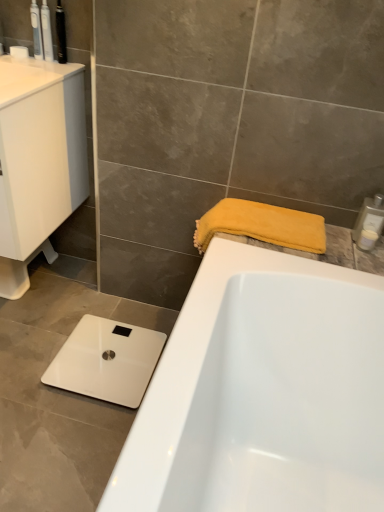
Measure the distance between matte white toothbrush at upper left, the fourth toiletry ordered from the bottom, and camera.

matte white toothbrush at upper left, the fourth toiletry ordered from the bottom, is 1.39 meters from camera.

Describe the element at coordinates (262, 225) in the screenshot. The width and height of the screenshot is (384, 512). I see `yellow soft towel at upper right` at that location.

This screenshot has width=384, height=512. Find the location of `translucent plastic toothbrush at upper left, which is the first toiletry in top-to-bottom order`. translucent plastic toothbrush at upper left, which is the first toiletry in top-to-bottom order is located at coordinates (36, 30).

Where is `white glossy scale at lower left`? white glossy scale at lower left is located at coordinates tap(106, 361).

From a real-world perspective, is yellow soft towel at upper right below translucent plastic toothbrush at upper left, which ranks as the fifth toiletry in right-to-left order?

Indeed, from a real-world perspective, yellow soft towel at upper right is positioned beneath translucent plastic toothbrush at upper left, which ranks as the fifth toiletry in right-to-left order.

Is yellow soft towel at upper right further to the viewer compared to translucent plastic toothbrush at upper left, which ranks as the fifth toiletry in right-to-left order?

No, the depth of yellow soft towel at upper right is less than that of translucent plastic toothbrush at upper left, which ranks as the fifth toiletry in right-to-left order.

Could you tell me if yellow soft towel at upper right is facing translucent plastic toothbrush at upper left, which ranks as the fifth toiletry in right-to-left order?

No, yellow soft towel at upper right is not aimed at translucent plastic toothbrush at upper left, which ranks as the fifth toiletry in right-to-left order.

From the image's perspective, is yellow soft towel at upper right positioned above or below translucent plastic toothbrush at upper left, which ranks as the fifth toiletry in bottom-to-top order?

From the image's perspective, yellow soft towel at upper right appears below translucent plastic toothbrush at upper left, which ranks as the fifth toiletry in bottom-to-top order.

Does point (131, 358) come behind point (43, 31)?

Yes, it is behind point (43, 31).

Is the position of white glossy scale at lower left more distant than that of matte white toothbrush at upper left, the second toiletry from the top?

Yes, white glossy scale at lower left is further from the viewer.

Would you consider white glossy scale at lower left to be distant from matte white toothbrush at upper left, the 4th toiletry in the right-to-left sequence?

white glossy scale at lower left is far away from matte white toothbrush at upper left, the 4th toiletry in the right-to-left sequence.

Is white glossy scale at lower left completely or partially outside of matte white toothbrush at upper left, which is counted as the 2th toiletry, starting from the left?

That's correct, white glossy scale at lower left is outside of matte white toothbrush at upper left, which is counted as the 2th toiletry, starting from the left.

Does white glossy scale at lower left turn towards metallic black toothbrush at upper left, the third toiletry positioned from the bottom?

No, white glossy scale at lower left does not turn towards metallic black toothbrush at upper left, the third toiletry positioned from the bottom.

What's the angular difference between white glossy scale at lower left and metallic black toothbrush at upper left, the third toiletry positioned from the bottom,'s facing directions?

88 degrees.

Would you consider white glossy scale at lower left to be distant from metallic black toothbrush at upper left, arranged as the 3th toiletry when viewed from the left?

Absolutely, white glossy scale at lower left is distant from metallic black toothbrush at upper left, arranged as the 3th toiletry when viewed from the left.

Which object is positioned more to the left, white glossy scale at lower left or metallic black toothbrush at upper left, acting as the 3th toiletry starting from the right?

metallic black toothbrush at upper left, acting as the 3th toiletry starting from the right, is more to the left.

Considering the sizes of yellow soft towel at upper right and matte white toothbrush at upper left, the 4th toiletry in the right-to-left sequence, in the image, is yellow soft towel at upper right taller or shorter than matte white toothbrush at upper left, the 4th toiletry in the right-to-left sequence,?

Clearly, yellow soft towel at upper right is shorter compared to matte white toothbrush at upper left, the 4th toiletry in the right-to-left sequence.

Between yellow soft towel at upper right and matte white toothbrush at upper left, which is counted as the 2th toiletry, starting from the left, which one has larger size?

yellow soft towel at upper right.

Locate an element on the screen. Image resolution: width=384 pixels, height=512 pixels. bath towel below the matte white toothbrush at upper left, the second toiletry from the top (from the image's perspective) is located at coordinates (262, 225).

Which object is closer to the camera, white plastic soap dispenser at upper right, which ranks as the second toiletry in right-to-left order, or white plastic soap dispenser at upper right, the second toiletry from the bottom?

white plastic soap dispenser at upper right, the second toiletry from the bottom, is closer to the camera.

Between point (371, 229) and point (365, 220), which one is positioned behind?

The point (365, 220) is more distant.

Is white plastic soap dispenser at upper right, the first toiletry positioned from the bottom, directly adjacent to white plastic soap dispenser at upper right, the second toiletry from the bottom?

Yes, white plastic soap dispenser at upper right, the first toiletry positioned from the bottom, and white plastic soap dispenser at upper right, the second toiletry from the bottom, clearly make contact.

Measure the distance from white plastic soap dispenser at upper right, which ranks as the second toiletry in right-to-left order, to white plastic soap dispenser at upper right, the 4th toiletry from the top.

The distance of white plastic soap dispenser at upper right, which ranks as the second toiletry in right-to-left order, from white plastic soap dispenser at upper right, the 4th toiletry from the top, is 1.08 inches.

From the image's perspective, which one is positioned lower, translucent plastic toothbrush at upper left, which ranks as the fifth toiletry in right-to-left order, or white glossy sink at left?

white glossy sink at left is shown below in the image.

Is translucent plastic toothbrush at upper left, which is the first toiletry in top-to-bottom order, further to the viewer compared to white glossy sink at left?

Yes, it is.

From a real-world perspective, between translucent plastic toothbrush at upper left, which ranks as the fifth toiletry in right-to-left order, and white glossy sink at left, who is vertically lower?

white glossy sink at left, from a real-world perspective.

Is translucent plastic toothbrush at upper left, which ranks as the fifth toiletry in right-to-left order, smaller than white glossy sink at left?

Correct, translucent plastic toothbrush at upper left, which ranks as the fifth toiletry in right-to-left order, occupies less space than white glossy sink at left.

Can you confirm if white glossy cabinet at upper left is smaller than matte white toothbrush at upper left, the second toiletry from the top?

No, white glossy cabinet at upper left is not smaller than matte white toothbrush at upper left, the second toiletry from the top.

Looking at this image, is white glossy cabinet at upper left wider or thinner than matte white toothbrush at upper left, the fourth toiletry ordered from the bottom?

white glossy cabinet at upper left is wider than matte white toothbrush at upper left, the fourth toiletry ordered from the bottom.

Is point (63, 65) positioned behind point (43, 0)?

Yes, point (63, 65) is behind point (43, 0).

Does white glossy cabinet at upper left turn towards matte white toothbrush at upper left, the fourth toiletry ordered from the bottom?

No.

At what (x,y) coordinates should I click in order to perform the action: click on bath towel below the translucent plastic toothbrush at upper left, which is the first toiletry in top-to-bottom order (from a real-world perspective). Please return your answer as a coordinate pair (x, y). This screenshot has width=384, height=512. Looking at the image, I should click on (262, 225).

Identify the location of appliance located behind the matte white toothbrush at upper left, the second toiletry from the top. The image size is (384, 512). (106, 361).

Based on their spatial positions, is translucent plastic toothbrush at upper left, which is the first toiletry in top-to-bottom order, or white glossy cabinet at upper left further from white plastic soap dispenser at upper right, which is the fourth toiletry in left-to-right order?

translucent plastic toothbrush at upper left, which is the first toiletry in top-to-bottom order.

Based on their spatial positions, is white plastic soap dispenser at upper right, acting as the first toiletry starting from the right, or white glossy scale at lower left further from metallic black toothbrush at upper left, the third toiletry when ordered from top to bottom?

white plastic soap dispenser at upper right, acting as the first toiletry starting from the right, is positioned further to the anchor metallic black toothbrush at upper left, the third toiletry when ordered from top to bottom.

When comparing their distances from translucent plastic toothbrush at upper left, which is the first toiletry in top-to-bottom order, does white glossy scale at lower left or yellow soft towel at upper right seem further?

white glossy scale at lower left is positioned further to the anchor translucent plastic toothbrush at upper left, which is the first toiletry in top-to-bottom order.

Looking at the image, which one is located closer to yellow soft towel at upper right, white plastic soap dispenser at upper right, which is the fourth toiletry in left-to-right order, or white glossy cabinet at upper left?

white plastic soap dispenser at upper right, which is the fourth toiletry in left-to-right order, is closer to yellow soft towel at upper right.

Looking at this image, based on their spatial positions, is white glossy sink at left or metallic black toothbrush at upper left, the third toiletry when ordered from top to bottom, further from white glossy cabinet at upper left?

Based on the image, metallic black toothbrush at upper left, the third toiletry when ordered from top to bottom, appears to be further to white glossy cabinet at upper left.

From the image, which object appears to be farther from white glossy cabinet at upper left, matte white toothbrush at upper left, the fourth toiletry ordered from the bottom, or white glossy scale at lower left?

Among the two, white glossy scale at lower left is located further to white glossy cabinet at upper left.

Which object lies nearer to the anchor point white plastic soap dispenser at upper right, the fifth toiletry when ordered from left to right, translucent plastic toothbrush at upper left, the 1th toiletry positioned from the left, or matte white toothbrush at upper left, the 4th toiletry in the right-to-left sequence?

matte white toothbrush at upper left, the 4th toiletry in the right-to-left sequence, is positioned closer to the anchor white plastic soap dispenser at upper right, the fifth toiletry when ordered from left to right.

When comparing their distances from translucent plastic toothbrush at upper left, which is the first toiletry in top-to-bottom order, does white plastic soap dispenser at upper right, acting as the first toiletry starting from the right, or yellow soft towel at upper right seem further?

The object further to translucent plastic toothbrush at upper left, which is the first toiletry in top-to-bottom order, is white plastic soap dispenser at upper right, acting as the first toiletry starting from the right.

Where is `sink between white glossy cabinet at upper left and white glossy scale at lower left in the up-down direction`? sink between white glossy cabinet at upper left and white glossy scale at lower left in the up-down direction is located at coordinates (38, 161).

The width and height of the screenshot is (384, 512). Find the location of `toiletry between matte white toothbrush at upper left, which is counted as the 2th toiletry, starting from the left, and white glossy sink at left vertically`. toiletry between matte white toothbrush at upper left, which is counted as the 2th toiletry, starting from the left, and white glossy sink at left vertically is located at coordinates (61, 33).

Locate an element on the screen. The width and height of the screenshot is (384, 512). bath towel between metallic black toothbrush at upper left, the third toiletry when ordered from top to bottom, and white glossy scale at lower left in the up-down direction is located at coordinates (262, 225).

At what (x,y) coordinates should I click in order to perform the action: click on bath towel between white glossy sink at left and white plastic soap dispenser at upper right, acting as the first toiletry starting from the right, in the horizontal direction. Please return your answer as a coordinate pair (x, y). Looking at the image, I should click on (262, 225).